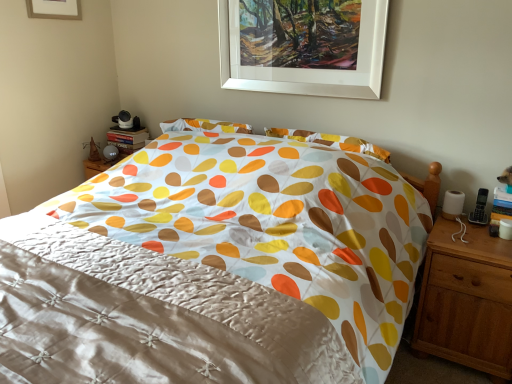
The height and width of the screenshot is (384, 512). Find the location of `light brown wood nightstand at right`. light brown wood nightstand at right is located at coordinates (466, 300).

Describe the element at coordinates (466, 300) in the screenshot. This screenshot has width=512, height=384. I see `light brown wood nightstand at right` at that location.

The image size is (512, 384). Find the location of `white matte picture frame at upper center, the 2th picture frame viewed from the right`. white matte picture frame at upper center, the 2th picture frame viewed from the right is located at coordinates [x=54, y=9].

Describe the element at coordinates (214, 268) in the screenshot. I see `silky white quilt at center` at that location.

The height and width of the screenshot is (384, 512). What are the coordinates of `light brown wood nightstand at right` in the screenshot? It's located at (466, 300).

From the image's perspective, is silky white quilt at center positioned above or below light brown wood nightstand at right?

silky white quilt at center is above light brown wood nightstand at right.

Is silky white quilt at center further to the viewer compared to light brown wood nightstand at right?

No, it is not.

Is silky white quilt at center directly adjacent to light brown wood nightstand at right?

No, silky white quilt at center is not in contact with light brown wood nightstand at right.

Can you confirm if white matte picture frame at upper center, which is the second picture frame from top to bottom, is wider than white matte picture frame at upper center, placed as the 1th picture frame when sorted from left to right?

Yes.

From the image's perspective, between white matte picture frame at upper center, which is the second picture frame from top to bottom, and white matte picture frame at upper center, marked as the second picture frame in a bottom-to-top arrangement, who is located below?

white matte picture frame at upper center, which is the second picture frame from top to bottom, is shown below in the image.

How different are the orientations of white matte picture frame at upper center, the 2th picture frame from the left, and white matte picture frame at upper center, the 2th picture frame viewed from the right, in degrees?

white matte picture frame at upper center, the 2th picture frame from the left, and white matte picture frame at upper center, the 2th picture frame viewed from the right, are facing 89.8 degrees away from each other.

Is white matte picture frame at upper center, the 2th picture frame from the left, placed right next to white matte picture frame at upper center, marked as the second picture frame in a bottom-to-top arrangement?

No, white matte picture frame at upper center, the 2th picture frame from the left, is not beside white matte picture frame at upper center, marked as the second picture frame in a bottom-to-top arrangement.

From the image's perspective, who appears lower, white matte picture frame at upper center, placed as the 1th picture frame when sorted from left to right, or white matte picture frame at upper center, marked as the 1th picture frame in a bottom-to-top arrangement?

From the image's view, white matte picture frame at upper center, marked as the 1th picture frame in a bottom-to-top arrangement, is below.

The width and height of the screenshot is (512, 384). Find the location of `picture frame above the white matte picture frame at upper center, the 1th picture frame viewed from the right (from a real-world perspective)`. picture frame above the white matte picture frame at upper center, the 1th picture frame viewed from the right (from a real-world perspective) is located at coordinates (54, 9).

Is white matte picture frame at upper center, the 2th picture frame viewed from the right, turned away from white matte picture frame at upper center, marked as the 1th picture frame in a bottom-to-top arrangement?

No, white matte picture frame at upper center, the 2th picture frame viewed from the right, is not facing away from white matte picture frame at upper center, marked as the 1th picture frame in a bottom-to-top arrangement.

Looking at their sizes, would you say white matte picture frame at upper center, the 1th picture frame viewed from the right, is wider or thinner than light brown wood nightstand at right?

white matte picture frame at upper center, the 1th picture frame viewed from the right, is thinner than light brown wood nightstand at right.

Looking at this image, between white matte picture frame at upper center, marked as the 1th picture frame in a bottom-to-top arrangement, and light brown wood nightstand at right, which one has smaller size?

With smaller size is white matte picture frame at upper center, marked as the 1th picture frame in a bottom-to-top arrangement.

From a real-world perspective, is white matte picture frame at upper center, the 2th picture frame from the left, beneath light brown wood nightstand at right?

No, from a real-world perspective, white matte picture frame at upper center, the 2th picture frame from the left, is not beneath light brown wood nightstand at right.

Is light brown wood nightstand at right a part of white matte picture frame at upper center, the 2th picture frame from the left?

No, white matte picture frame at upper center, the 2th picture frame from the left, does not contain light brown wood nightstand at right.

Does light brown wood nightstand at right have a lesser height compared to white matte picture frame at upper center, placed as the 1th picture frame when sorted from left to right?

Incorrect, the height of light brown wood nightstand at right does not fall short of that of white matte picture frame at upper center, placed as the 1th picture frame when sorted from left to right.

How many degrees apart are the facing directions of light brown wood nightstand at right and white matte picture frame at upper center, the 2th picture frame viewed from the right?

The facing directions of light brown wood nightstand at right and white matte picture frame at upper center, the 2th picture frame viewed from the right, are 89.1 degrees apart.

Considering the sizes of objects light brown wood nightstand at right and white matte picture frame at upper center, the 2th picture frame viewed from the right, in the image provided, who is bigger, light brown wood nightstand at right or white matte picture frame at upper center, the 2th picture frame viewed from the right,?

light brown wood nightstand at right.

Is light brown wood nightstand at right facing away from white matte picture frame at upper center, the 2th picture frame viewed from the right?

No, light brown wood nightstand at right's orientation is not away from white matte picture frame at upper center, the 2th picture frame viewed from the right.

From the image's perspective, is light brown wood nightstand at right located above silky white quilt at center?

Incorrect, from the image's perspective, light brown wood nightstand at right is lower than silky white quilt at center.

Is light brown wood nightstand at right closer to the viewer compared to silky white quilt at center?

No, the depth of light brown wood nightstand at right is greater than that of silky white quilt at center.

Considering the relative sizes of light brown wood nightstand at right and silky white quilt at center in the image provided, is light brown wood nightstand at right smaller than silky white quilt at center?

Yes.

Measure the distance between light brown wood nightstand at right and silky white quilt at center.

light brown wood nightstand at right and silky white quilt at center are 70.67 centimeters apart from each other.

Can you confirm if white matte picture frame at upper center, which is the second picture frame from top to bottom, is shorter than silky white quilt at center?

Yes, white matte picture frame at upper center, which is the second picture frame from top to bottom, is shorter than silky white quilt at center.

The height and width of the screenshot is (384, 512). I want to click on bed on the left side of white matte picture frame at upper center, the 2th picture frame from the left, so click(214, 268).

Is point (262, 76) less distant than point (148, 303)?

No.

You are a GUI agent. You are given a task and a screenshot of the screen. Output one action in this format:
    pyautogui.click(x=<x>, y=<y>)
    Task: Click on the bed that is above the light brown wood nightstand at right (from a real-world perspective)
    
    Given the screenshot: What is the action you would take?
    pyautogui.click(x=214, y=268)

At what (x,y) coordinates should I click in order to perform the action: click on picture frame behind the white matte picture frame at upper center, the 1th picture frame viewed from the right. Please return your answer as a coordinate pair (x, y). Looking at the image, I should click on (54, 9).

Estimate the real-world distances between objects in this image. Which object is further from silky white quilt at center, light brown wood nightstand at right or white matte picture frame at upper center, placed as the 1th picture frame when sorted from left to right?

Based on the image, white matte picture frame at upper center, placed as the 1th picture frame when sorted from left to right, appears to be further to silky white quilt at center.

Looking at the image, which one is located further to silky white quilt at center, white matte picture frame at upper center, the 2th picture frame from the left, or light brown wood nightstand at right?

Among the two, white matte picture frame at upper center, the 2th picture frame from the left, is located further to silky white quilt at center.

Looking at the image, which one is located further to white matte picture frame at upper center, marked as the 1th picture frame in a bottom-to-top arrangement, light brown wood nightstand at right or white matte picture frame at upper center, placed as the 1th picture frame when sorted from left to right?

The object further to white matte picture frame at upper center, marked as the 1th picture frame in a bottom-to-top arrangement, is white matte picture frame at upper center, placed as the 1th picture frame when sorted from left to right.

From the image, which object appears to be farther from white matte picture frame at upper center, the 2th picture frame viewed from the right, white matte picture frame at upper center, the 1th picture frame viewed from the right, or silky white quilt at center?

silky white quilt at center lies further to white matte picture frame at upper center, the 2th picture frame viewed from the right, than the other object.

Looking at this image, from the image, which object appears to be farther from white matte picture frame at upper center, the 2th picture frame viewed from the right, silky white quilt at center or white matte picture frame at upper center, marked as the 1th picture frame in a bottom-to-top arrangement?

Based on the image, silky white quilt at center appears to be further to white matte picture frame at upper center, the 2th picture frame viewed from the right.

Looking at the image, which one is located closer to white matte picture frame at upper center, placed as the 1th picture frame when sorted from left to right, white matte picture frame at upper center, which is the second picture frame from top to bottom, or light brown wood nightstand at right?

white matte picture frame at upper center, which is the second picture frame from top to bottom.

Estimate the real-world distances between objects in this image. Which object is further from white matte picture frame at upper center, the 1th picture frame viewed from the right, silky white quilt at center or white matte picture frame at upper center, the 2th picture frame viewed from the right?

white matte picture frame at upper center, the 2th picture frame viewed from the right, is further to white matte picture frame at upper center, the 1th picture frame viewed from the right.

Estimate the real-world distances between objects in this image. Which object is closer to white matte picture frame at upper center, placed as the 1th picture frame when sorted from left to right, silky white quilt at center or light brown wood nightstand at right?

Among the two, silky white quilt at center is located nearer to white matte picture frame at upper center, placed as the 1th picture frame when sorted from left to right.

Find the location of a particular element. The width and height of the screenshot is (512, 384). picture frame located between white matte picture frame at upper center, marked as the second picture frame in a bottom-to-top arrangement, and light brown wood nightstand at right in the left-right direction is located at coordinates (303, 46).

Where is `nightstand located between silky white quilt at center and white matte picture frame at upper center, the 1th picture frame viewed from the right, in the depth direction`? This screenshot has height=384, width=512. nightstand located between silky white quilt at center and white matte picture frame at upper center, the 1th picture frame viewed from the right, in the depth direction is located at coordinates (466, 300).

Find the location of `picture frame between silky white quilt at center and white matte picture frame at upper center, the 2th picture frame viewed from the right, from front to back`. picture frame between silky white quilt at center and white matte picture frame at upper center, the 2th picture frame viewed from the right, from front to back is located at coordinates (303, 46).

Where is `bed between white matte picture frame at upper center, placed as the 1th picture frame when sorted from left to right, and light brown wood nightstand at right`? bed between white matte picture frame at upper center, placed as the 1th picture frame when sorted from left to right, and light brown wood nightstand at right is located at coordinates (214, 268).